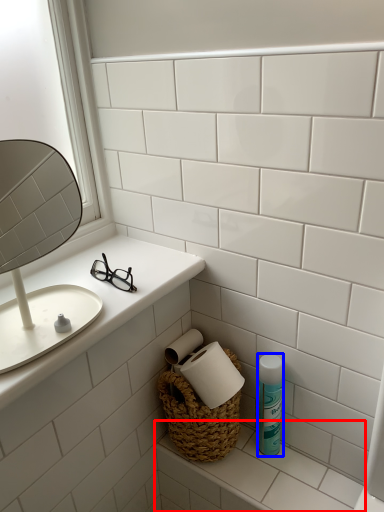
Question: Among these objects, which one is farthest to the camera, counter top (highlighted by a red box) or mouthwash (highlighted by a blue box)?

Choices:
 (A) counter top
 (B) mouthwash

Answer: (B)